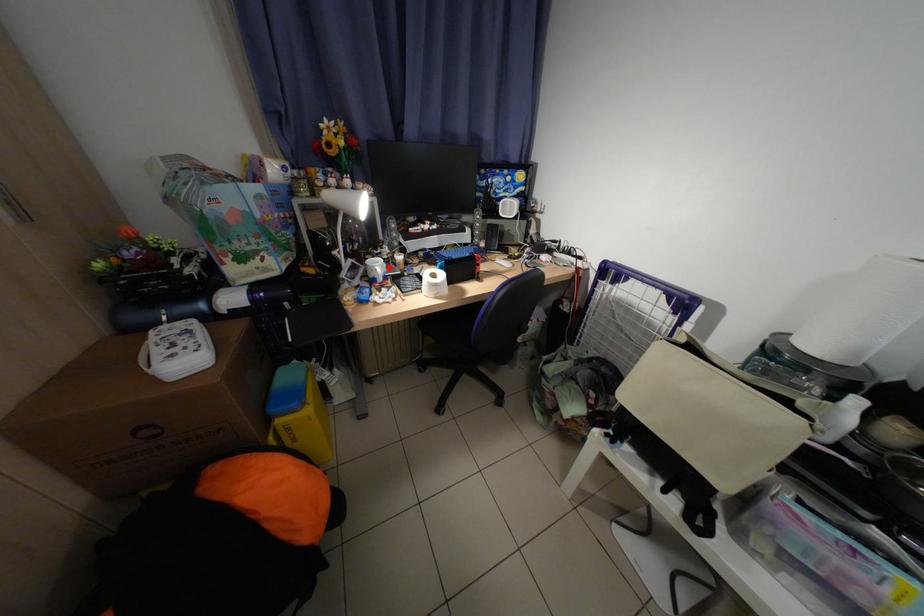
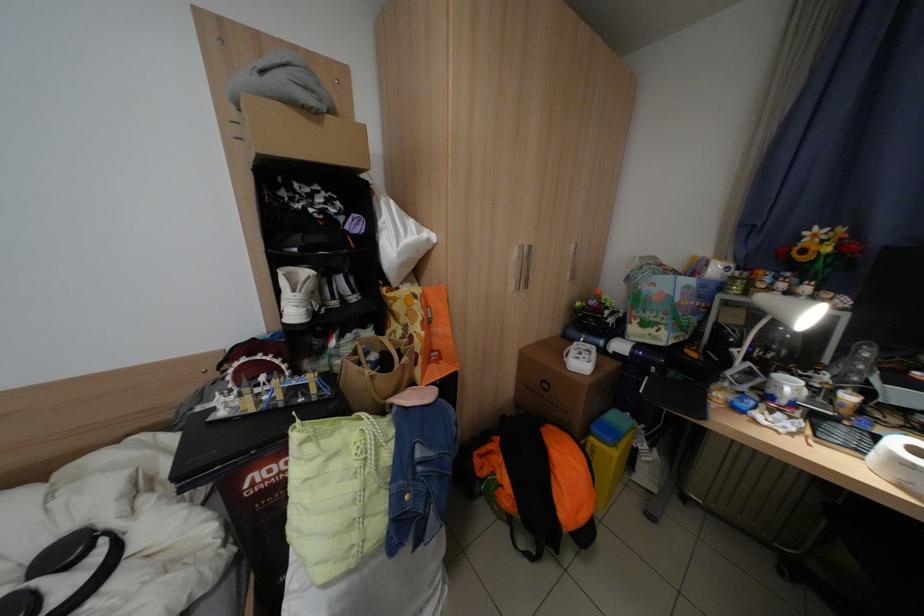
The point at the highlighted location is marked in the first image. Where is the corresponding point in the second image?

(800, 387)